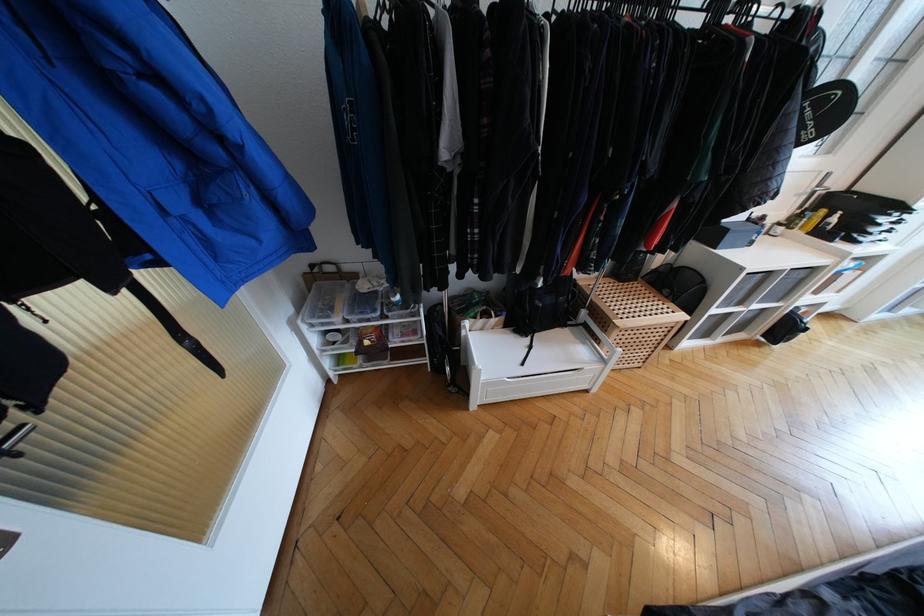
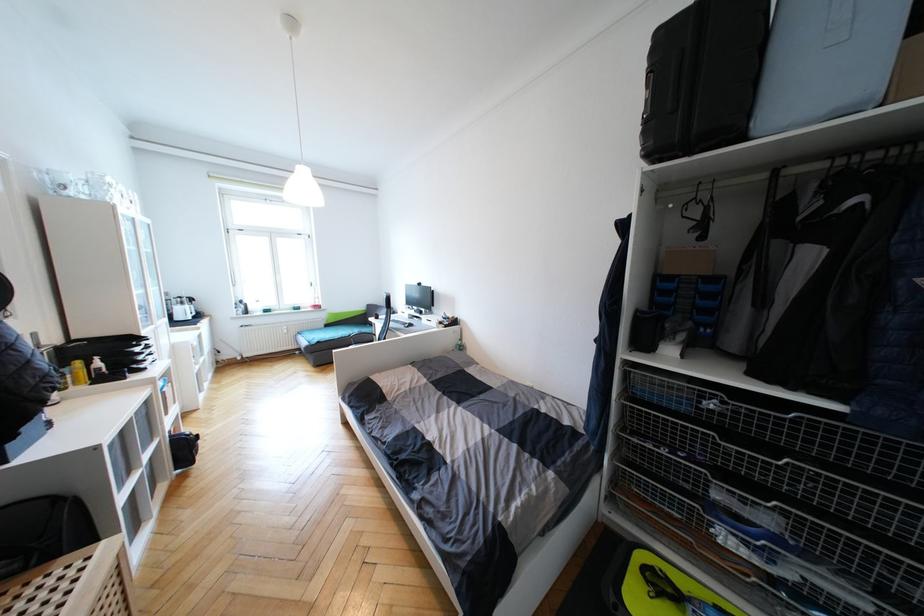
Find the pixel in the second image that matches the point at 825,213 in the first image.

(81, 363)